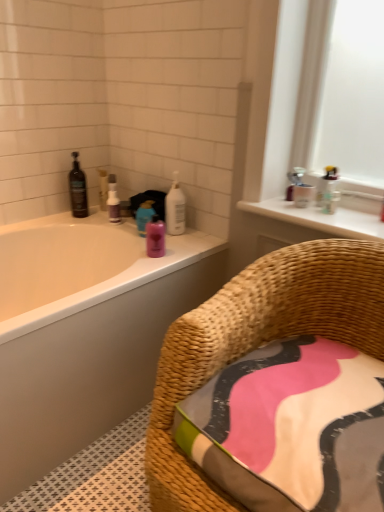
Question: From a real-world perspective, is white glossy bottle at upper center, the 1th cleaning product when ordered from right to left, on white glossy window sill at upper right?

Choices:
 (A) no
 (B) yes

Answer: (A)

Question: Is white glossy bottle at upper center, arranged as the 2th cleaning product when viewed from the left, turned away from white glossy window sill at upper right?

Choices:
 (A) no
 (B) yes

Answer: (A)

Question: From the image's perspective, is white glossy bottle at upper center, arranged as the 2th cleaning product when viewed from the left, on white glossy window sill at upper right?

Choices:
 (A) yes
 (B) no

Answer: (A)

Question: Is white glossy bottle at upper center, the 1th cleaning product when ordered from right to left, in front of white glossy window sill at upper right?

Choices:
 (A) yes
 (B) no

Answer: (B)

Question: Is white glossy bottle at upper center, the 1th cleaning product when ordered from right to left, aimed at white glossy window sill at upper right?

Choices:
 (A) yes
 (B) no

Answer: (B)

Question: Considering the relative sizes of white glossy bottle at upper center, the 1th cleaning product when ordered from right to left, and white glossy window sill at upper right in the image provided, is white glossy bottle at upper center, the 1th cleaning product when ordered from right to left, taller than white glossy window sill at upper right?

Choices:
 (A) yes
 (B) no

Answer: (A)

Question: Is white glossy bathtub at upper left shorter than white glossy window sill at upper right?

Choices:
 (A) yes
 (B) no

Answer: (B)

Question: From a real-world perspective, is white glossy bathtub at upper left positioned under white glossy window sill at upper right based on gravity?

Choices:
 (A) yes
 (B) no

Answer: (A)

Question: Is white glossy bathtub at upper left oriented towards white glossy window sill at upper right?

Choices:
 (A) yes
 (B) no

Answer: (B)

Question: Is white glossy bathtub at upper left at the left side of white glossy window sill at upper right?

Choices:
 (A) no
 (B) yes

Answer: (B)

Question: From the image's perspective, would you say white glossy bathtub at upper left is shown under white glossy window sill at upper right?

Choices:
 (A) yes
 (B) no

Answer: (A)

Question: Is white glossy bathtub at upper left facing away from white glossy window sill at upper right?

Choices:
 (A) yes
 (B) no

Answer: (B)

Question: From a real-world perspective, is woven rattan chair at lower right physically above black glass bottle at upper left?

Choices:
 (A) yes
 (B) no

Answer: (B)